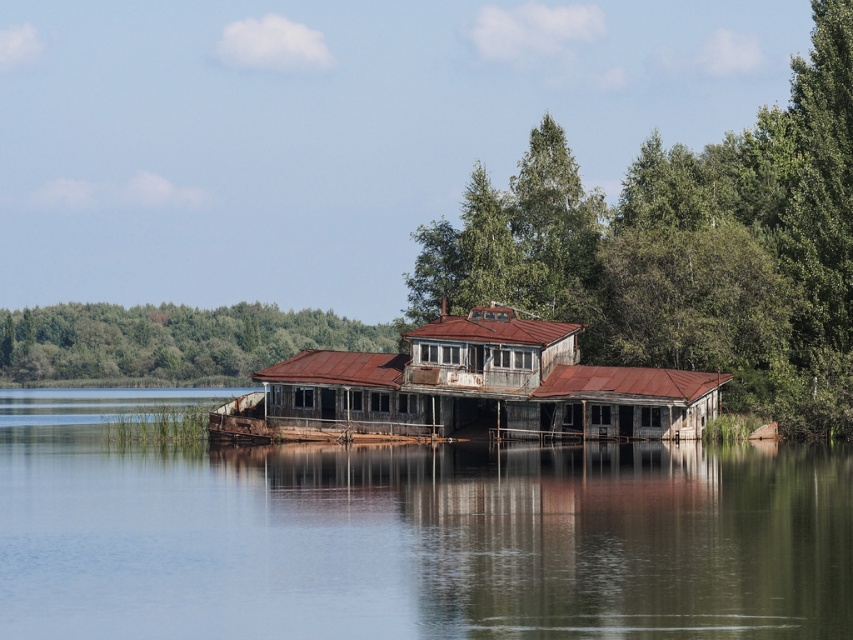
Question: Among these objects, which one is nearest to the camera?

Choices:
 (A) rusty wood hut at center
 (B) green leafy trees at left
 (C) rusty metal hut at center
 (D) rusty metallic water at center

Answer: (D)

Question: Is rusty metal building at center further to the viewer compared to rusty wood hut at center?

Choices:
 (A) yes
 (B) no

Answer: (B)

Question: Does rusty metal building at center have a lesser width compared to green leafy trees at left?

Choices:
 (A) no
 (B) yes

Answer: (B)

Question: Based on their relative distances, which object is nearer to the rusty metal hut at center?

Choices:
 (A) rusty metallic water at center
 (B) rusty wood hut at center

Answer: (B)

Question: Which point appears farthest from the camera in this image?

Choices:
 (A) (x=477, y=374)
 (B) (x=776, y=164)

Answer: (B)

Question: Does rusty metallic water at center have a smaller size compared to rusty metal building at center?

Choices:
 (A) no
 (B) yes

Answer: (A)